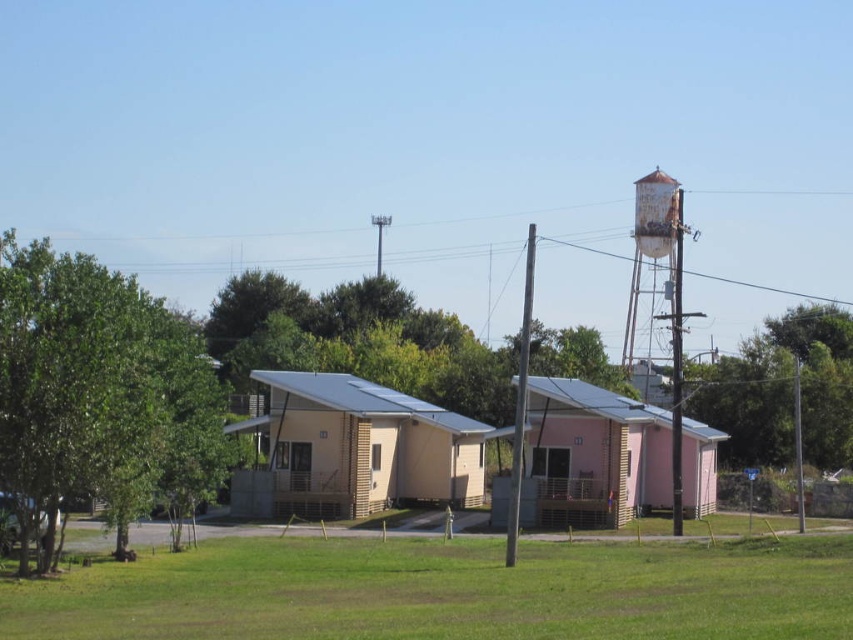
In the scene shown: You are planning to install a new satellite dish that requires a clear view of the southern sky. You have two options for placement near the beige wood cabin at center or under the green leafy tree at left. Based on their heights, which location would provide an unobstructed view?

The beige wood cabin at center is shorter than the green leafy tree at left. Therefore, placing the satellite dish near the beige wood cabin at center would provide a better unobstructed view of the southern sky since it is shorter and less likely to block the dish.

You are standing in the middle of the grassy area between the beige wood cabin at center and the rusty metal water tower at upper right. Which object is closer to you?

The beige wood cabin at center is closer to you because it is further to the viewer than the rusty metal water tower at upper right, meaning it appears nearer in the scene.